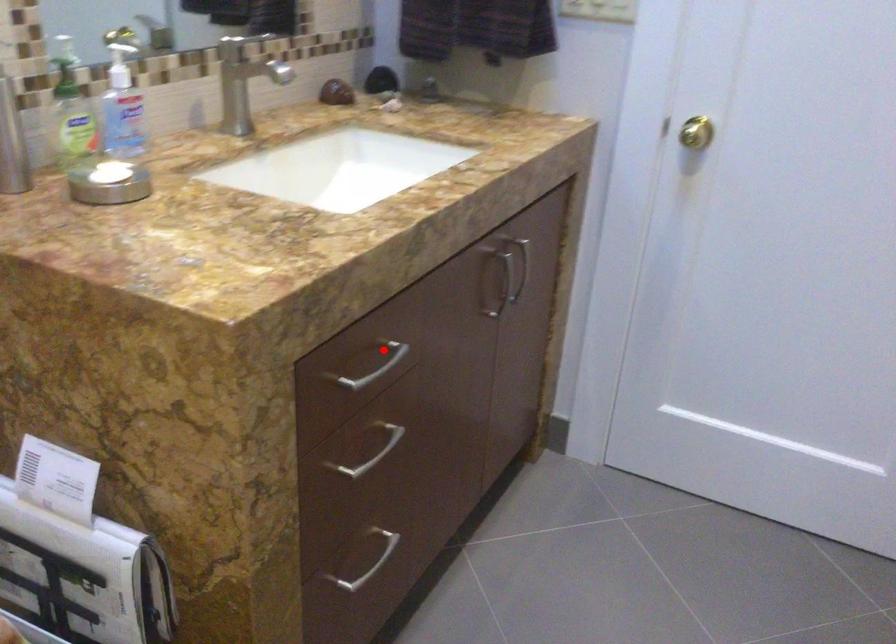
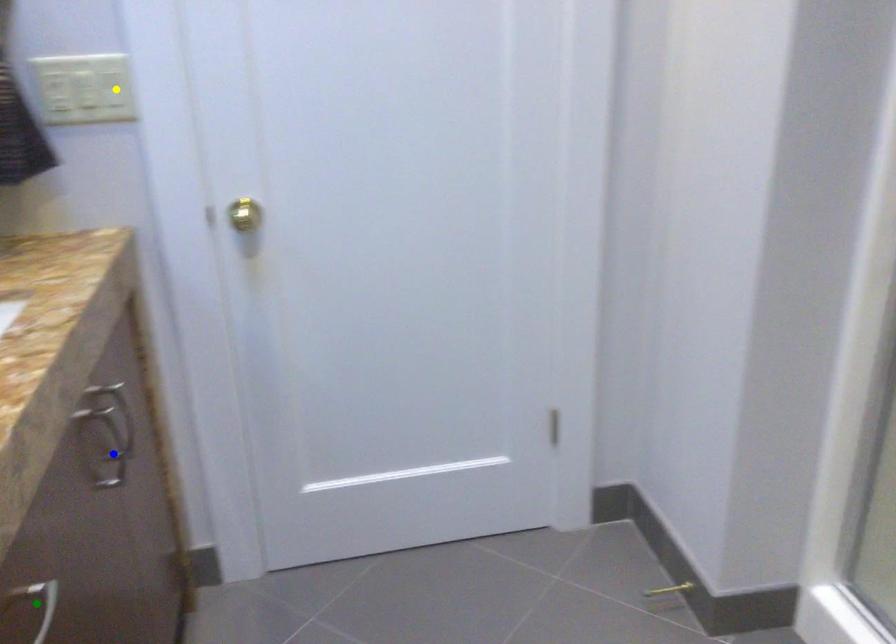
Question: I am providing you with two images of the same scene from different viewpoints. A red point is marked on the first image. You are given multiple points on the second image. Can you choose the point in image 2 that corresponds to the point in image 1?

Choices:
 (A) green point
 (B) yellow point
 (C) blue point

Answer: (A)